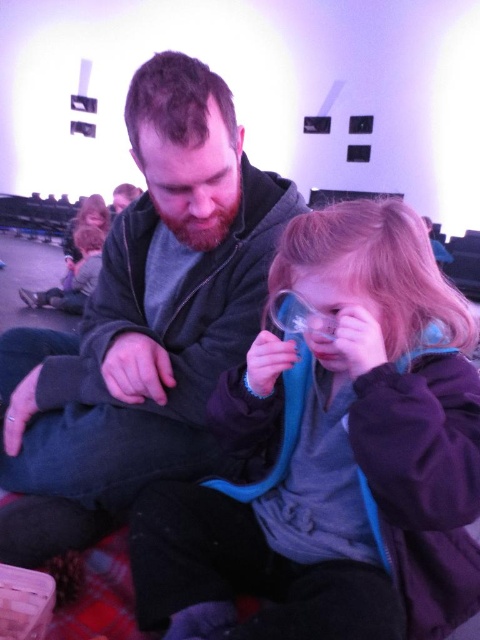
Question: Estimate the real-world distances between objects in this image. Which object is closer to the transparent plastic goggles at center?

Choices:
 (A) purple fleece jacket at center
 (B) dark gray hoodie at center

Answer: (A)

Question: Can you confirm if purple fleece jacket at center is wider than transparent plastic goggles at center?

Choices:
 (A) yes
 (B) no

Answer: (A)

Question: Among these points, which one is farthest from the camera?

Choices:
 (A) (405, 285)
 (B) (308, 307)
 (C) (83, 476)

Answer: (C)

Question: Which point appears closest to the camera in this image?

Choices:
 (A) (219, 86)
 (B) (313, 317)
 (C) (470, 458)

Answer: (C)

Question: Does purple fleece jacket at center appear over transparent plastic goggles at center?

Choices:
 (A) yes
 (B) no

Answer: (B)

Question: From the image, what is the correct spatial relationship of purple fleece jacket at center in relation to transparent plastic goggles at center?

Choices:
 (A) below
 (B) above

Answer: (A)